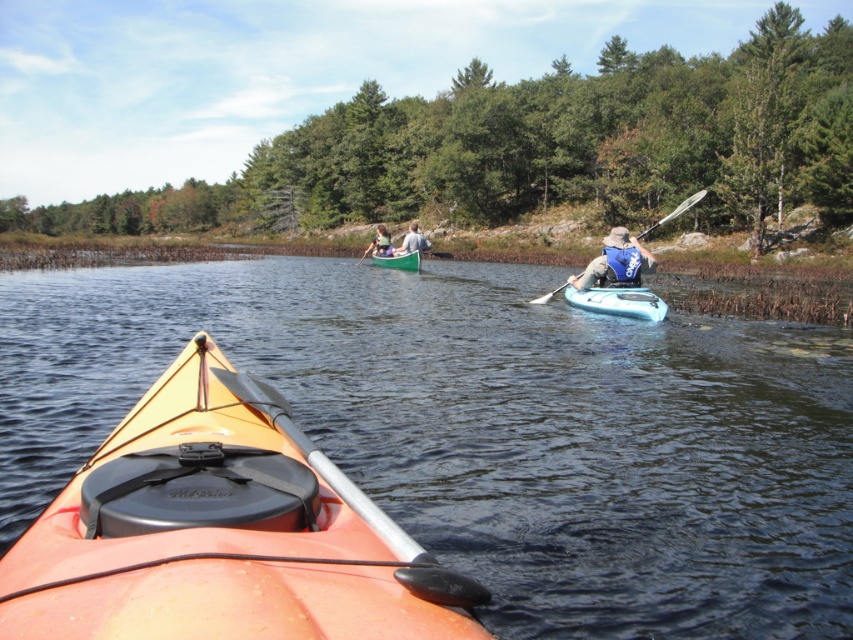
Question: Which point is farther to the camera?

Choices:
 (A) green wooden canoe at center
 (B) orange kayak at center

Answer: (A)

Question: Which point is farther to the camera?

Choices:
 (A) matte gray kayak at center
 (B) orange matte kayak at lower left
 (C) light brown wooden paddle at center

Answer: (C)

Question: Can you confirm if blue glossy kayak at center is positioned below light brown wooden paddle at center?

Choices:
 (A) yes
 (B) no

Answer: (A)

Question: Considering the relative positions of orange kayak at center and light brown wooden paddle at center in the image provided, where is orange kayak at center located with respect to light brown wooden paddle at center?

Choices:
 (A) below
 (B) above

Answer: (A)

Question: Does orange kayak at center have a larger size compared to blue glossy kayak at center?

Choices:
 (A) yes
 (B) no

Answer: (A)

Question: Among these objects, which one is farthest from the camera?

Choices:
 (A) blue glossy kayak at center
 (B) green wooden canoe at center
 (C) light brown wooden paddle at center
 (D) orange kayak at center

Answer: (C)